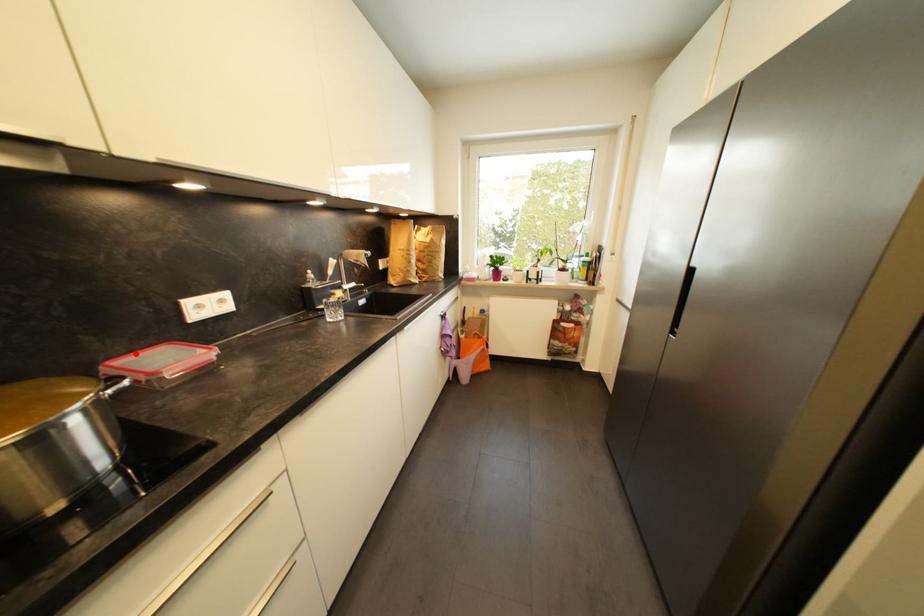
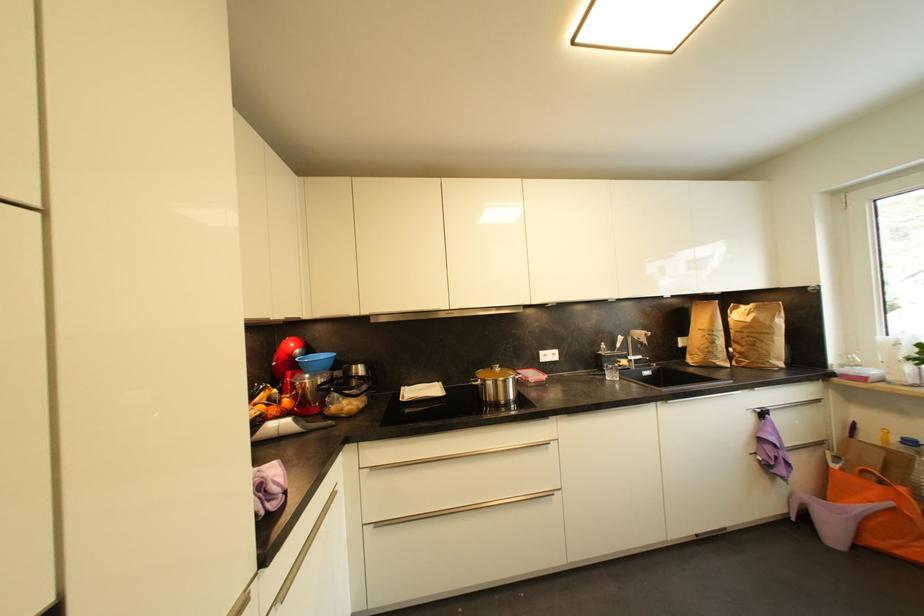
Question: I am providing you with two images of the same scene from different viewpoints. Image1 has a red point marked. In image2, the corresponding 3D location appears at what relative position? Reply with the corresponding letter.

Choices:
 (A) Closer
 (B) Farther

Answer: (B)